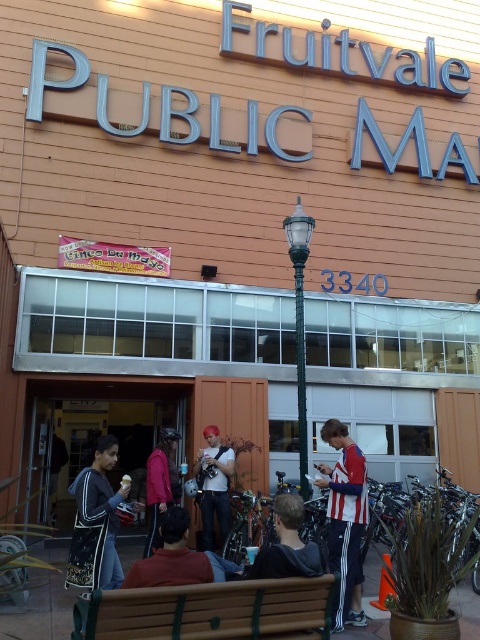
Question: Can you confirm if green matte lamp post at center is wider than red matte jacket at center?

Choices:
 (A) yes
 (B) no

Answer: (B)

Question: Which point appears closest to the camera in this image?

Choices:
 (A) (220, 483)
 (B) (324, 467)
 (C) (300, 326)
 (D) (173, 548)

Answer: (D)

Question: Does black and white hoodie at lower left appear on the right side of matte white shirt at center?

Choices:
 (A) yes
 (B) no

Answer: (B)

Question: Which of the following is the closest to the observer?

Choices:
 (A) green matte lamp post at center
 (B) matte white shirt at center
 (C) black and white hoodie at lower left
 (D) striped jersey at center

Answer: (C)

Question: Which of the following is the farthest from the observer?

Choices:
 (A) (360, 484)
 (B) (156, 515)

Answer: (B)

Question: Observing the image, what is the correct spatial positioning of dark brown leather jacket at lower center in reference to matte white shirt at center?

Choices:
 (A) right
 (B) left

Answer: (A)